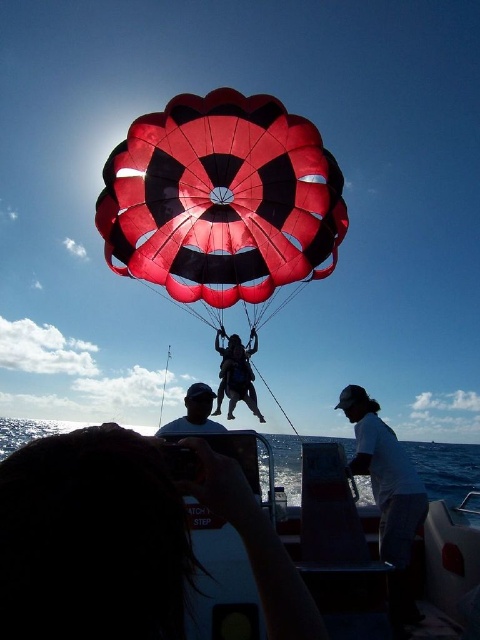
Question: Is white plastic boat at lower center in front of transparent blue water at lower center?

Choices:
 (A) yes
 (B) no

Answer: (A)

Question: Among these points, which one is farthest from the camera?

Choices:
 (A) (193, 420)
 (B) (241, 342)

Answer: (B)

Question: Can you confirm if red/black nylon parachute at center is wider than white cotton shirt at lower right?

Choices:
 (A) no
 (B) yes

Answer: (B)

Question: Does white plastic boat at lower center appear on the right side of white cotton shirt at lower right?

Choices:
 (A) no
 (B) yes

Answer: (A)

Question: Which point appears closest to the camera in this image?

Choices:
 (A) (54, 456)
 (B) (204, 387)
 (C) (331, 241)

Answer: (A)

Question: Which point is closer to the camera?

Choices:
 (A) (186, 412)
 (B) (248, 404)
 (C) (51, 438)
 (D) (279, 460)

Answer: (C)